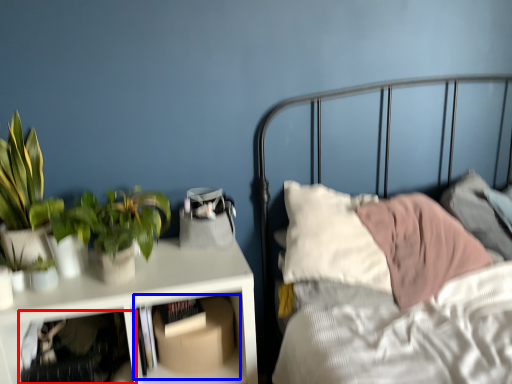
Question: Which of the following is the farthest to the observer, shelf (highlighted by a red box) or shelf (highlighted by a blue box)?

Choices:
 (A) shelf
 (B) shelf

Answer: (B)